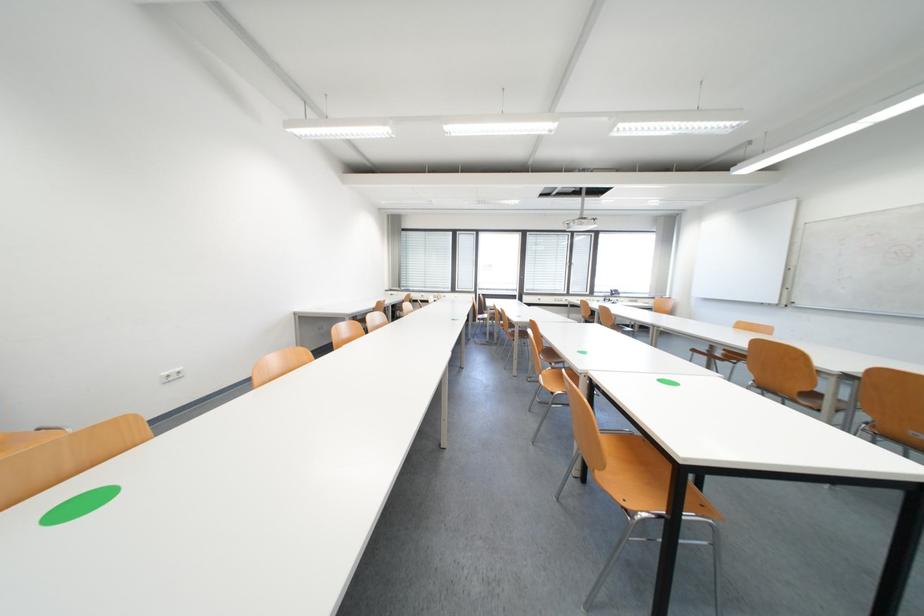
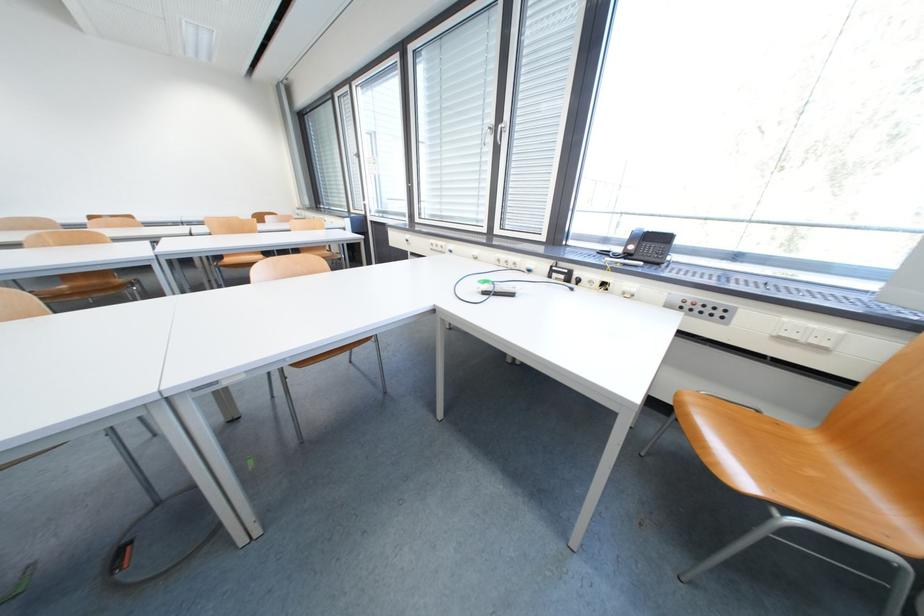
Where in the second image is the point corresponding to (640,302) from the first image?

(725, 315)